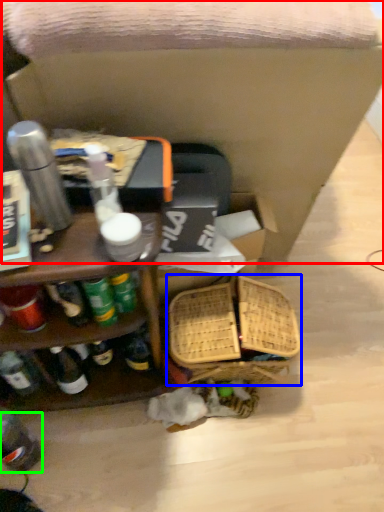
Question: Which object is positioned closest to swivel chair (highlighted by a red box)? Select from basket (highlighted by a blue box) and bottle (highlighted by a green box).

Choices:
 (A) basket
 (B) bottle

Answer: (A)